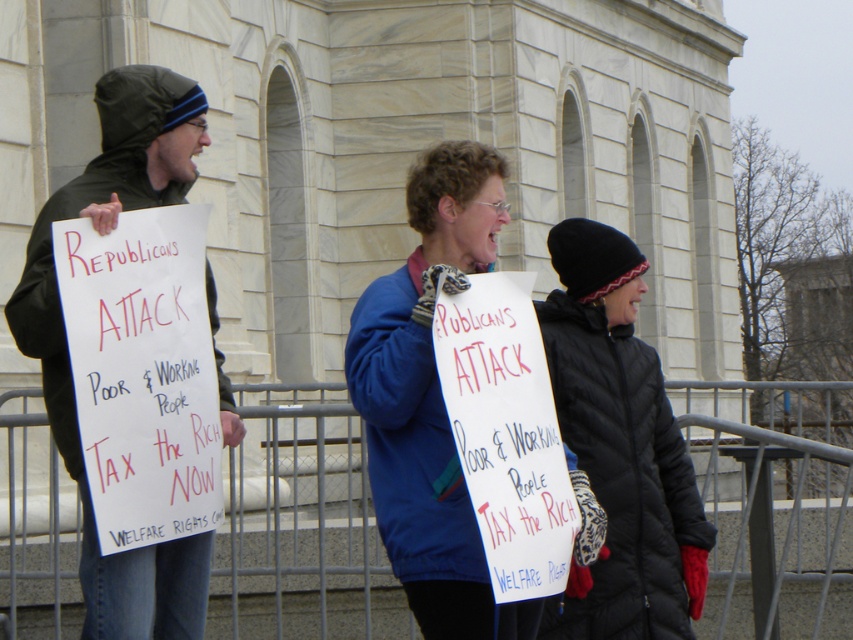
Between white paper sign at left and dark green jacket at left, which one appears on the left side from the viewer's perspective?

dark green jacket at left

Between point (117, 268) and point (164, 81), which one is positioned behind?

The point (164, 81) is behind.

Between point (194, 388) and point (131, 205), which one is positioned in front?

Point (194, 388)

Find the location of a particular element. This screenshot has width=853, height=640. white paper sign at left is located at coordinates (142, 372).

Find the location of a particular element. metal fence at center is located at coordinates (300, 522).

What are the coordinates of `metal fence at center` in the screenshot? It's located at (300, 522).

Does black quilted jacket at center have a larger size compared to dark green jacket at left?

Correct, black quilted jacket at center is larger in size than dark green jacket at left.

Who is shorter, black quilted jacket at center or dark green jacket at left?

Standing shorter between the two is dark green jacket at left.

Find the location of `black quilted jacket at center`. black quilted jacket at center is located at coordinates (619, 448).